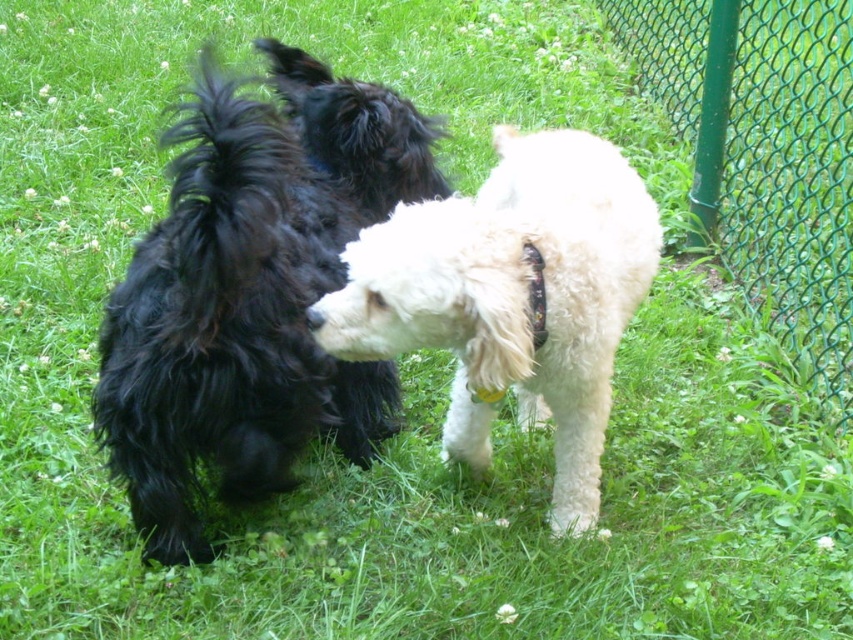
Is point (363, 349) less distant than point (759, 150)?

That is True.

Can you confirm if white fluffy dog at center is positioned above green wire mesh fence at right?

Incorrect, white fluffy dog at center is not positioned above green wire mesh fence at right.

This screenshot has width=853, height=640. What are the coordinates of `white fluffy dog at center` in the screenshot? It's located at (511, 298).

Does shiny black fur at center come behind green wire mesh fence at right?

No.

Who is positioned more to the right, shiny black fur at center or green wire mesh fence at right?

green wire mesh fence at right is more to the right.

Who is more distant from viewer, (392, 371) or (747, 296)?

The point (747, 296) is more distant.

Where is `shiny black fur at center`? shiny black fur at center is located at coordinates (251, 292).

Who is more distant from viewer, (184, 317) or (584, 275)?

Point (584, 275)

Between point (341, 180) and point (587, 188), which one is positioned in front?

Point (587, 188)

Does point (311, 435) come closer to viewer compared to point (474, 426)?

Yes, it is.

Identify the location of shiny black fur at center. The image size is (853, 640). (251, 292).